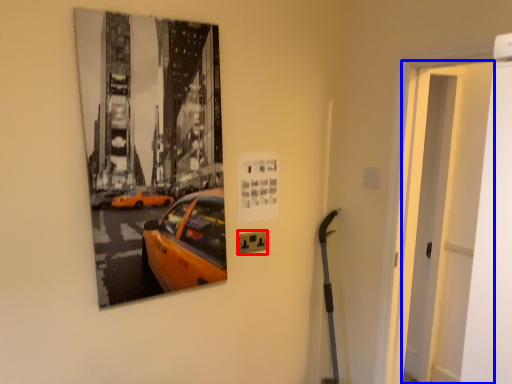
Question: Which point is further to the camera, electric outlet (highlighted by a red box) or door (highlighted by a blue box)?

Choices:
 (A) electric outlet
 (B) door

Answer: (A)